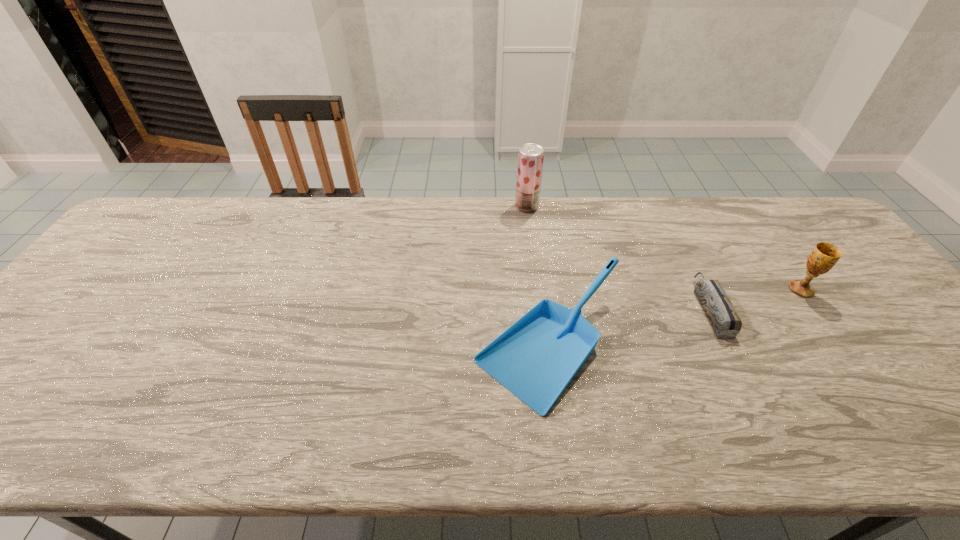
Where is `object at the far edge`? The height and width of the screenshot is (540, 960). object at the far edge is located at coordinates 530,156.

In order to click on object that is at the near edge in this screenshot , I will do `click(536, 358)`.

In order to click on free space at the far edge in this screenshot , I will do `click(625, 227)`.

The height and width of the screenshot is (540, 960). I want to click on vacant position at the near edge of the desktop, so point(559,429).

The image size is (960, 540). I want to click on vacant space at the left edge of the desktop, so click(124, 276).

In the image, there is a desktop. Identify the location of free space at the far left corner. (172, 201).

Locate an element on the screen. The image size is (960, 540). vacant area that lies between the farthest object and the dustpan is located at coordinates (538, 275).

Find the location of a particular element. Image resolution: width=960 pixels, height=540 pixels. vacant area that lies between the pencil box and the fruit juice is located at coordinates (618, 257).

Where is `vacant area that lies between the second object from right to left and the farthest object`? The height and width of the screenshot is (540, 960). vacant area that lies between the second object from right to left and the farthest object is located at coordinates (618, 257).

Find the location of a particular element. The height and width of the screenshot is (540, 960). free space between the tallest object and the rightmost object is located at coordinates (663, 248).